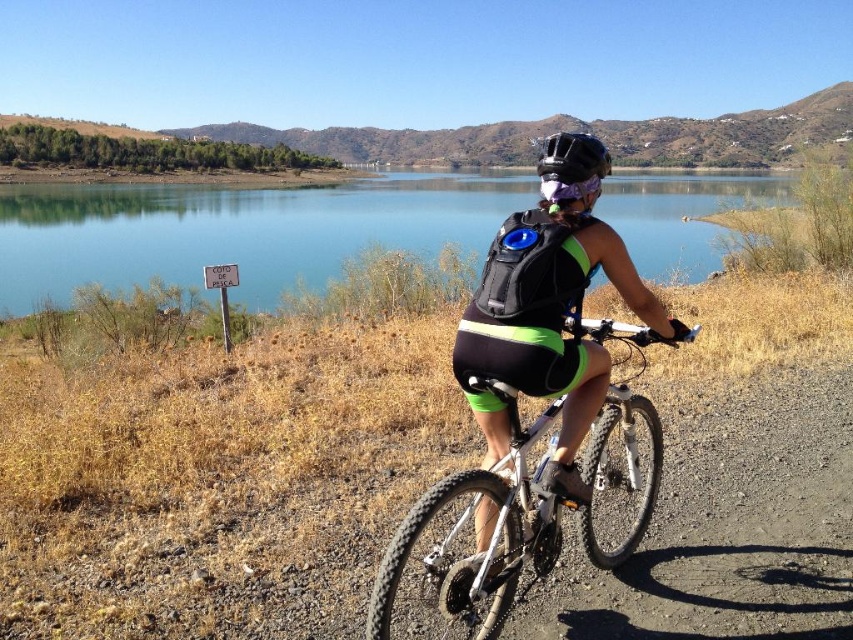
Is blue water at center taller than white metallic bicycle at center?

Yes.

Can you confirm if blue water at center is wider than white metallic bicycle at center?

Yes.

Is point (186, 252) more distant than point (490, 561)?

That is True.

The width and height of the screenshot is (853, 640). Find the location of `blue water at center`. blue water at center is located at coordinates (236, 230).

Is black matte cycling shorts at center behind white metallic bicycle at center?

That is True.

Which is below, black matte cycling shorts at center or white metallic bicycle at center?

white metallic bicycle at center is lower down.

Measure the distance between point (564, 289) and camera.

Point (564, 289) is 2.84 meters away from camera.

Image resolution: width=853 pixels, height=640 pixels. Find the location of `black matte cycling shorts at center`. black matte cycling shorts at center is located at coordinates (547, 326).

Who is more distant from viewer, (445, 172) or (573, 368)?

Point (445, 172)

Which is in front, point (9, 227) or point (596, 264)?

Positioned in front is point (596, 264).

Does point (329, 212) lie behind point (524, 214)?

Yes, it is behind point (524, 214).

This screenshot has height=640, width=853. What are the coordinates of `blue water at center` in the screenshot? It's located at (236, 230).